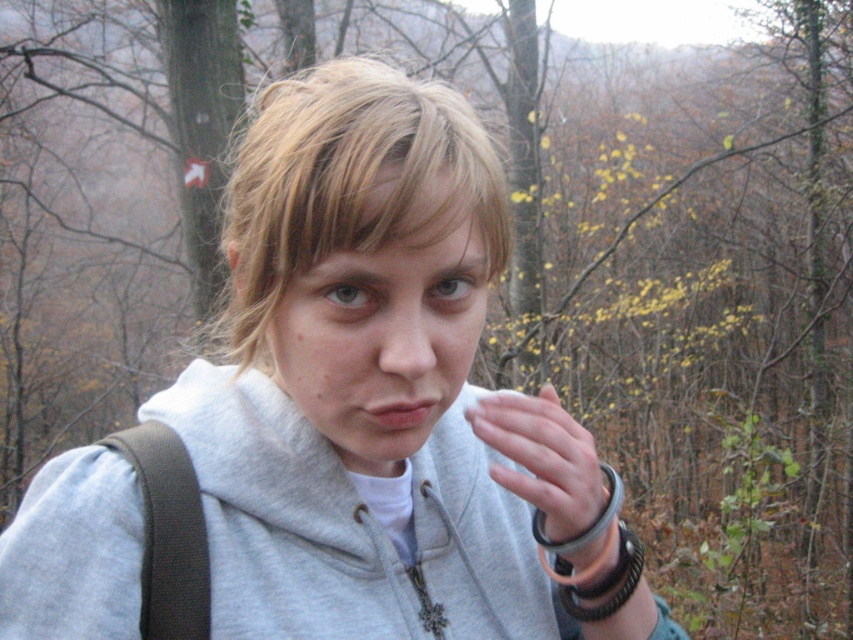
Between blondehair at center and white matte cloth at center, which one has less height?

Standing shorter between the two is white matte cloth at center.

At what (x,y) coordinates should I click in order to perform the action: click on blondehair at center. Please return your answer as a coordinate pair (x, y). Image resolution: width=853 pixels, height=640 pixels. Looking at the image, I should click on (349, 186).

Between gray sweatshirt at center and brown leather bracelet at lower right, which one appears on the left side from the viewer's perspective?

From the viewer's perspective, gray sweatshirt at center appears more on the left side.

Which is in front, point (294, 627) or point (614, 604)?

Point (294, 627) is more forward.

Find the location of `gray sweatshirt at center`. gray sweatshirt at center is located at coordinates click(380, 392).

Does blondehair at center come in front of brown leather bracelet at lower right?

Yes, blondehair at center is in front of brown leather bracelet at lower right.

Where is `blondehair at center`? The image size is (853, 640). blondehair at center is located at coordinates (349, 186).

Does point (230, 349) come behind point (614, 589)?

Yes.

Where is `blondehair at center`? The width and height of the screenshot is (853, 640). blondehair at center is located at coordinates (349, 186).